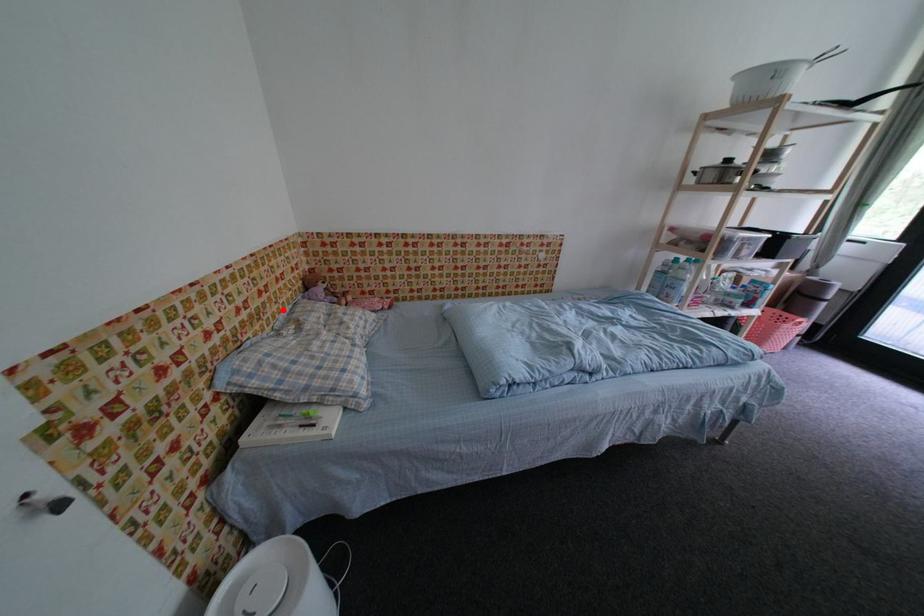
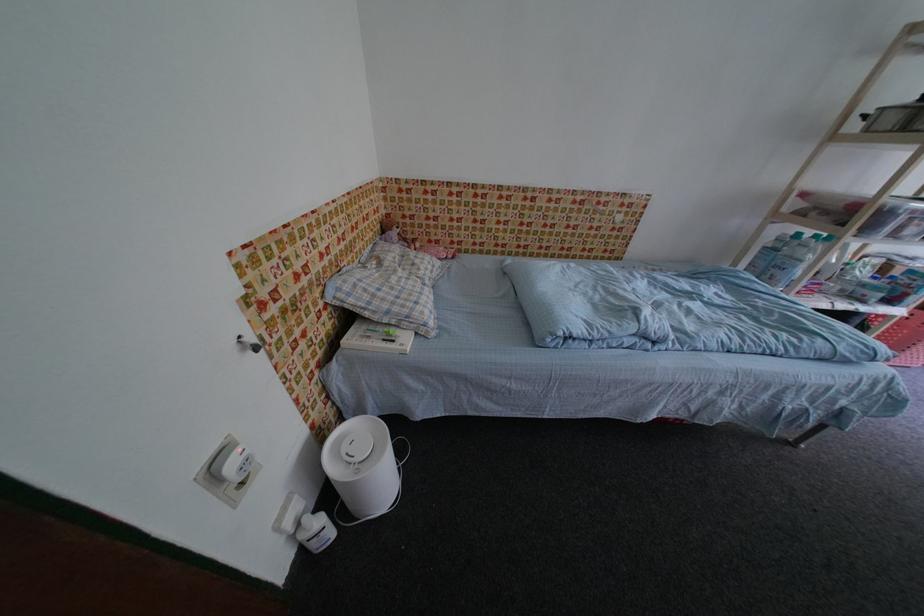
Where in the second image is the point corresponding to the highlighted location from the first image?

(370, 246)